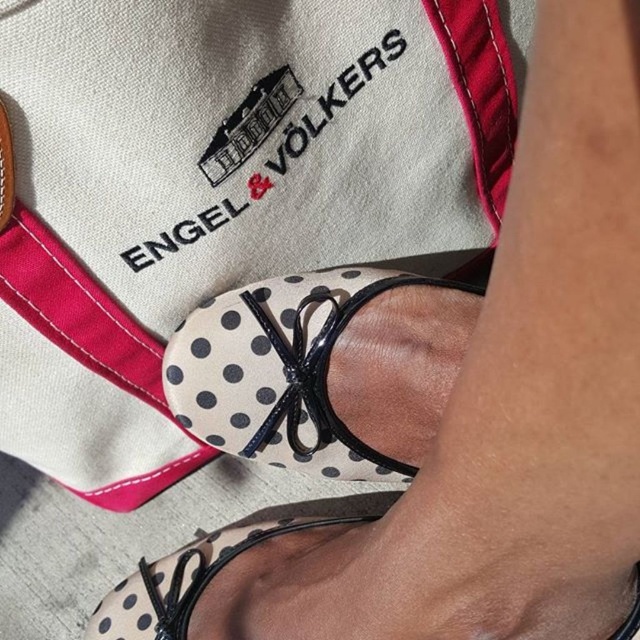
From the picture: You are a fashion designer observing the image of a person wearing shoes and a fabric item with a brand logo. You need to determine which object is taller between the white dotted fabric sandal at center and the white dotted fabric at lower center. Based on the scene, which one is taller?

The white dotted fabric sandal at center is much taller than the white dotted fabric at lower center.

You are designing a shoe display and need to arrange the white dotted fabric sandal at center and the white dotted fabric at lower center. Which one should be placed first if you want to follow the size order from largest to smallest?

The white dotted fabric sandal at center should be placed first because it is larger in size than the white dotted fabric at lower center.